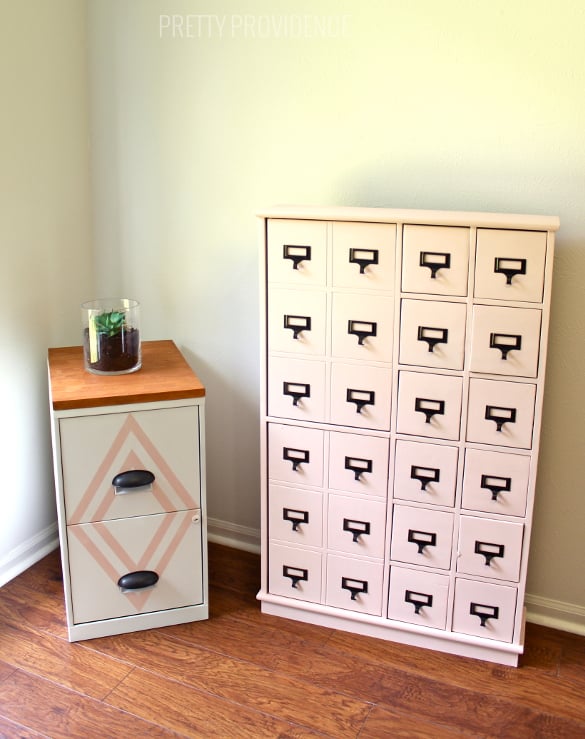
Where is `plant`? The width and height of the screenshot is (585, 739). plant is located at coordinates (115, 321).